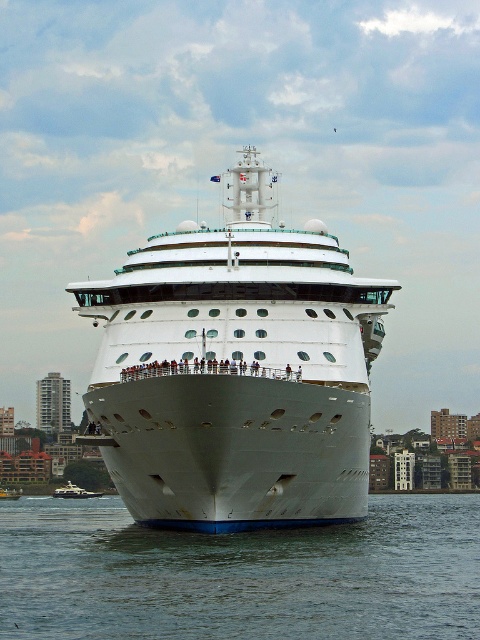
You are standing on the cruise ship and want to take a photo of the city skyline. The camera you are using has a maximum zoom range of 200 feet. Is the point at coordinates point [176,490] within the camera zoom range?

The point at coordinates point [176,490] is 261.16 feet away from the camera, which exceeds the camera maximum zoom range of 200 feet. Therefore, the point is out of the camera zoom range.

You are a photographer trying to capture the entire cruise ship and city skyline in one shot. Given that the white matte water at center and white glossy boat at center are both in the frame, which object will occupy more space in your photo?

The white matte water at center will occupy more space in the photo because it has a larger size compared to the white glossy boat at center.